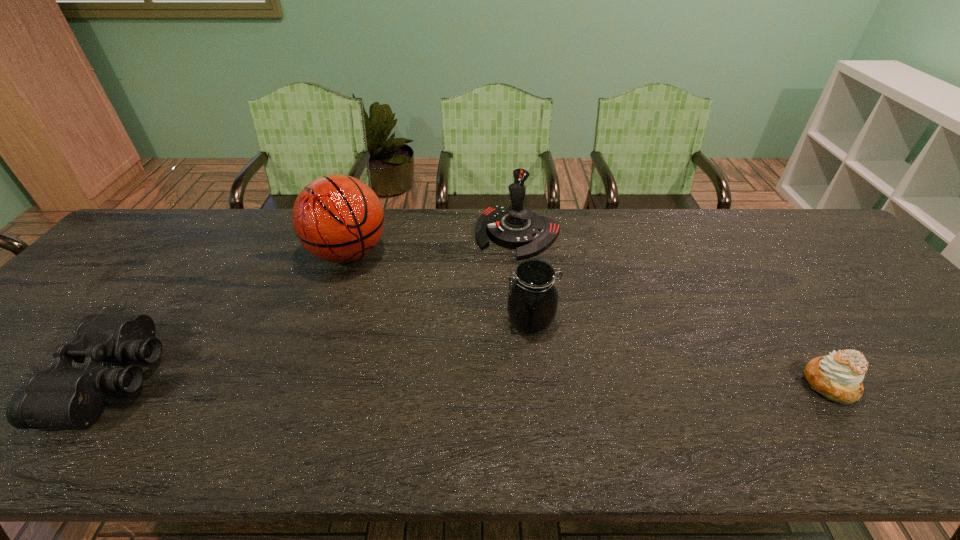
You are a GUI agent. You are given a task and a screenshot of the screen. Output one action in this format:
    pyautogui.click(x=<x>, y=<y>)
    Task: Click on the free space between the jar and the binoculars
    This screenshot has width=960, height=540.
    Given the screenshot: What is the action you would take?
    pyautogui.click(x=323, y=350)

Image resolution: width=960 pixels, height=540 pixels. I want to click on free spot between the fourth shortest object and the binoculars, so click(316, 306).

The height and width of the screenshot is (540, 960). Identify the location of free area in between the binoculars and the basketball. (231, 316).

Where is `vacant space that is in between the binoculars and the jar`? The image size is (960, 540). vacant space that is in between the binoculars and the jar is located at coordinates (323, 350).

You are a GUI agent. You are given a task and a screenshot of the screen. Output one action in this format:
    pyautogui.click(x=<x>, y=<y>)
    Task: Click on the free space between the second object from left to right and the rightmost object
    
    Given the screenshot: What is the action you would take?
    coord(588,319)

Identify the location of vacant space that's between the jar and the pastry. (680, 352).

Locate an element on the screen. The image size is (960, 540). free spot between the pastry and the leftmost object is located at coordinates (471, 381).

Locate an element on the screen. The image size is (960, 540). vacant space in between the jar and the basketball is located at coordinates (440, 287).

Locate which object ranks third in proximity to the rightmost object. Please provide its 2D coordinates. Your answer should be formatted as a tuple, i.e. [(x, y)], where the tuple contains the x and y coordinates of a point satisfying the conditions above.

[(337, 218)]

Point out which object is positioned as the nearest to the tallest object. Please provide its 2D coordinates. Your answer should be formatted as a tuple, i.e. [(x, y)], where the tuple contains the x and y coordinates of a point satisfying the conditions above.

[(516, 227)]